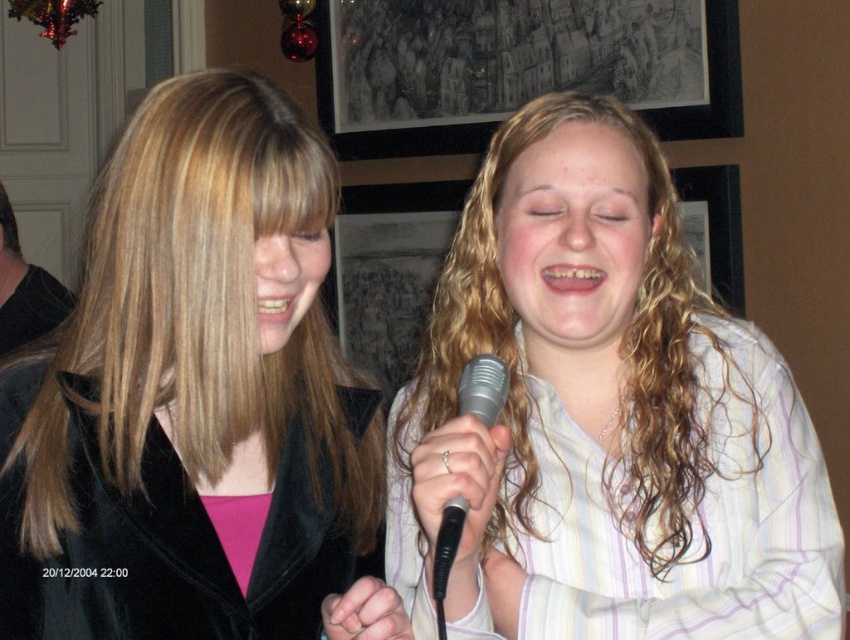
Question: Considering the real-world distances, which object is closest to the white striped shirt at center?

Choices:
 (A) matte black jacket at left
 (B) silver metallic microphone at center

Answer: (B)

Question: Which is nearer to the matte black jacket at left?

Choices:
 (A) silver metallic microphone at center
 (B) white striped shirt at center

Answer: (B)

Question: Observing the image, what is the correct spatial positioning of white striped shirt at center in reference to matte black jacket at left?

Choices:
 (A) above
 (B) below

Answer: (B)

Question: From the image, what is the correct spatial relationship of matte black jacket at left in relation to silver metallic microphone at center?

Choices:
 (A) below
 (B) above

Answer: (B)

Question: Which is farther from the white striped shirt at center?

Choices:
 (A) matte black jacket at left
 (B) silver metallic microphone at center

Answer: (A)

Question: Is matte black jacket at left to the left of silver metallic microphone at center from the viewer's perspective?

Choices:
 (A) no
 (B) yes

Answer: (B)